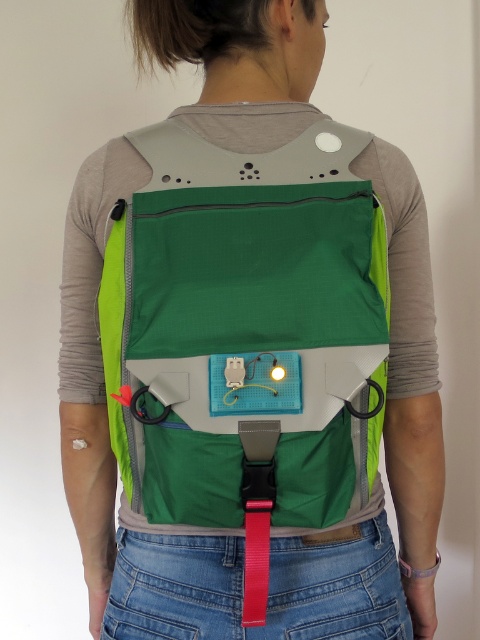
Question: Can you confirm if green fabric vest at center is thinner than red matte strap at center?

Choices:
 (A) yes
 (B) no

Answer: (B)

Question: In this image, where is green fabric vest at center located relative to red matte strap at center?

Choices:
 (A) right
 (B) left

Answer: (B)

Question: Can you confirm if green fabric vest at center is smaller than red matte strap at center?

Choices:
 (A) no
 (B) yes

Answer: (A)

Question: Which object is farther from the camera taking this photo?

Choices:
 (A) green fabric vest at center
 (B) red matte strap at center

Answer: (B)

Question: Which point is farther from the camera taking this photo?

Choices:
 (A) (x=247, y=528)
 (B) (x=337, y=422)

Answer: (B)